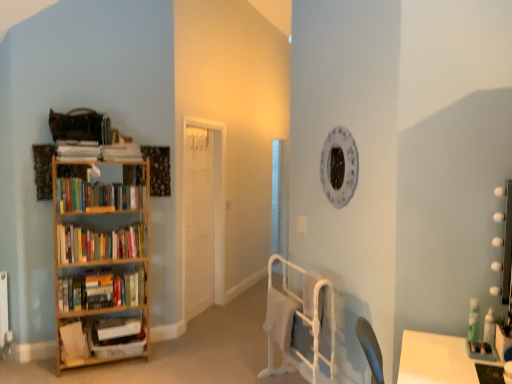
Identify the location of free space in front of white matte bookshelf at left, which ranks as the 2th book in bottom-to-top order. The height and width of the screenshot is (384, 512). (51, 378).